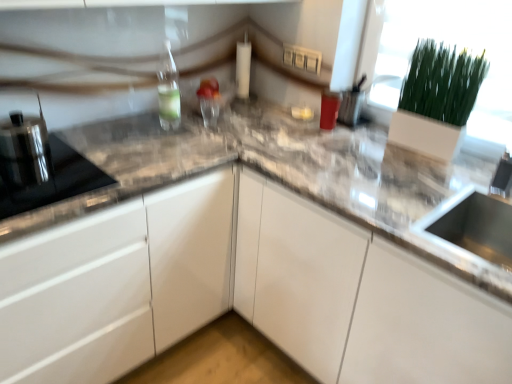
Locate an element on the screen. vacant area that is in front of white matte glass door at upper right is located at coordinates (429, 168).